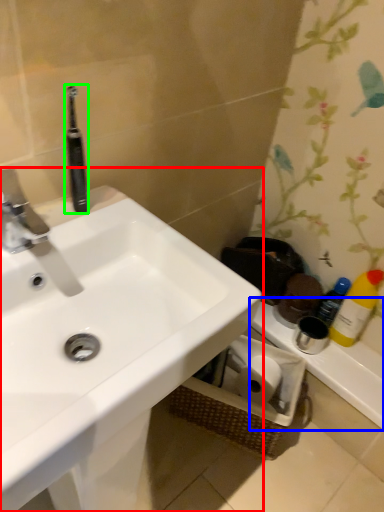
Question: Considering the real-world distances, which object is farthest from sink (highlighted by a red box)? counter top (highlighted by a blue box) or toothbrush (highlighted by a green box)?

Choices:
 (A) counter top
 (B) toothbrush

Answer: (A)